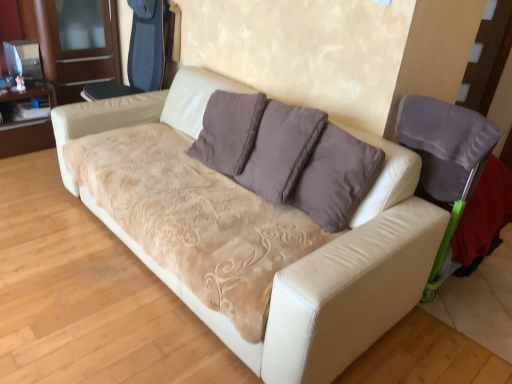
Where is `dark blue fabric armchair at upper left, placed as the 1th armchair when sorted from top to bottom`? This screenshot has width=512, height=384. dark blue fabric armchair at upper left, placed as the 1th armchair when sorted from top to bottom is located at coordinates (142, 52).

This screenshot has height=384, width=512. Find the location of `velvet purple armchair at right, the second armchair positioned from the left`. velvet purple armchair at right, the second armchair positioned from the left is located at coordinates (445, 157).

Could you tell me if brushed wood dresser at left is turned towards dark blue fabric armchair at upper left, which is counted as the 2th armchair, starting from the bottom?

Yes.

Are brushed wood dresser at left and dark blue fabric armchair at upper left, which is the first armchair in back-to-front order, beside each other?

brushed wood dresser at left is not next to dark blue fabric armchair at upper left, which is the first armchair in back-to-front order, and they're not touching.

Can you confirm if brushed wood dresser at left is shorter than dark blue fabric armchair at upper left, placed as the 1th armchair when sorted from top to bottom?

No, brushed wood dresser at left is not shorter than dark blue fabric armchair at upper left, placed as the 1th armchair when sorted from top to bottom.

Which is behind, point (50, 0) or point (152, 80)?

Point (50, 0)

Is brushed wood dresser at left a part of velvet purple armchair at right, which is the second armchair in back-to-front order?

No, brushed wood dresser at left is not inside velvet purple armchair at right, which is the second armchair in back-to-front order.

Is point (425, 163) more distant than point (85, 64)?

That is False.

Considering the sizes of objects velvet purple armchair at right, the first armchair viewed from the front, and brushed wood dresser at left in the image provided, who is thinner, velvet purple armchair at right, the first armchair viewed from the front, or brushed wood dresser at left?

brushed wood dresser at left is thinner.

How different are the orientations of velvet purple armchair at right, placed as the 1th armchair when sorted from right to left, and brushed wood dresser at left in degrees?

The angular difference between velvet purple armchair at right, placed as the 1th armchair when sorted from right to left, and brushed wood dresser at left is 89.7 degrees.

Does white leather couch at center appear on the right side of dark blue fabric armchair at upper left, marked as the first armchair in a left-to-right arrangement?

Yes.

Is white leather couch at center not within dark blue fabric armchair at upper left, which is counted as the 2th armchair, starting from the bottom?

Yes, white leather couch at center is outside of dark blue fabric armchair at upper left, which is counted as the 2th armchair, starting from the bottom.

How many degrees apart are the facing directions of white leather couch at center and dark blue fabric armchair at upper left, which is the second armchair in right-to-left order?

The angle between the facing direction of white leather couch at center and the facing direction of dark blue fabric armchair at upper left, which is the second armchair in right-to-left order, is 0.301 degrees.

Locate an element on the screen. armchair to the left of white leather couch at center is located at coordinates (142, 52).

Which is behind, white leather couch at center or velvet purple armchair at right, which is the 1th armchair in bottom-to-top order?

velvet purple armchair at right, which is the 1th armchair in bottom-to-top order, is more distant.

Is white leather couch at center taller or shorter than velvet purple armchair at right, the second armchair positioned from the left?

Clearly, white leather couch at center is taller compared to velvet purple armchair at right, the second armchair positioned from the left.

Does white leather couch at center touch velvet purple armchair at right, which is the 1th armchair in bottom-to-top order?

They are not placed beside each other.

Do you think white leather couch at center is within velvet purple armchair at right, which is the 1th armchair in bottom-to-top order, or outside of it?

white leather couch at center lies outside velvet purple armchair at right, which is the 1th armchair in bottom-to-top order.

Can you tell me how much dark blue fabric armchair at upper left, which is counted as the 2th armchair, starting from the bottom, and brushed wood dresser at left differ in facing direction?

dark blue fabric armchair at upper left, which is counted as the 2th armchair, starting from the bottom, and brushed wood dresser at left are facing 90.3 degrees away from each other.

Can you confirm if dark blue fabric armchair at upper left, which is counted as the 2th armchair, starting from the bottom, is shorter than brushed wood dresser at left?

Indeed, dark blue fabric armchair at upper left, which is counted as the 2th armchair, starting from the bottom, has a lesser height compared to brushed wood dresser at left.

Which object is thinner, dark blue fabric armchair at upper left, which is the first armchair in back-to-front order, or brushed wood dresser at left?

brushed wood dresser at left is thinner.

Considering the relative positions of dark blue fabric armchair at upper left, which is the first armchair in back-to-front order, and velvet purple armchair at right, placed as the 1th armchair when sorted from right to left, in the image provided, is dark blue fabric armchair at upper left, which is the first armchair in back-to-front order, to the left or to the right of velvet purple armchair at right, placed as the 1th armchair when sorted from right to left,?

Clearly, dark blue fabric armchair at upper left, which is the first armchair in back-to-front order, is on the left of velvet purple armchair at right, placed as the 1th armchair when sorted from right to left, in the image.

You are a GUI agent. You are given a task and a screenshot of the screen. Output one action in this format:
    pyautogui.click(x=<x>, y=<y>)
    Task: Click on the armchair located above the velvet purple armchair at right, the second armchair positioned from the left (from a real-world perspective)
    
    Given the screenshot: What is the action you would take?
    tap(142, 52)

Which is behind, point (144, 8) or point (453, 168)?

The point (144, 8) is farther from the camera.

From a real-world perspective, relative to velvet purple armchair at right, the first armchair viewed from the front, is dark blue fabric armchair at upper left, positioned as the second armchair in front-to-back order, vertically above or below?

Clearly, from a real-world perspective, dark blue fabric armchair at upper left, positioned as the second armchair in front-to-back order, is above velvet purple armchair at right, the first armchair viewed from the front.

Can you confirm if velvet purple armchair at right, which is the 1th armchair in bottom-to-top order, is positioned to the right of white leather couch at center?

Indeed, velvet purple armchair at right, which is the 1th armchair in bottom-to-top order, is positioned on the right side of white leather couch at center.

Is the depth of velvet purple armchair at right, the first armchair viewed from the front, less than that of white leather couch at center?

That is False.

Considering the sizes of velvet purple armchair at right, which is the 1th armchair in bottom-to-top order, and white leather couch at center in the image, is velvet purple armchair at right, which is the 1th armchair in bottom-to-top order, taller or shorter than white leather couch at center?

velvet purple armchair at right, which is the 1th armchair in bottom-to-top order, is shorter than white leather couch at center.

Is velvet purple armchair at right, placed as the 1th armchair when sorted from right to left, looking in the opposite direction of white leather couch at center?

Correct, velvet purple armchair at right, placed as the 1th armchair when sorted from right to left, is looking away from white leather couch at center.

Which armchair is the 1st one when counting from the right side of the brushed wood dresser at left? Please provide its 2D coordinates.

[(142, 52)]

Where is `armchair below the brushed wood dresser at left (from a real-world perspective)`? The image size is (512, 384). armchair below the brushed wood dresser at left (from a real-world perspective) is located at coordinates (445, 157).

From the image, which object appears to be farther from brushed wood dresser at left, white leather couch at center or velvet purple armchair at right, the first armchair viewed from the front?

velvet purple armchair at right, the first armchair viewed from the front.

When comparing their distances from velvet purple armchair at right, the 2th armchair viewed from the top, does white leather couch at center or dark blue fabric armchair at upper left, positioned as the second armchair in front-to-back order, seem further?

dark blue fabric armchair at upper left, positioned as the second armchair in front-to-back order, is positioned further to the anchor velvet purple armchair at right, the 2th armchair viewed from the top.

Considering their positions, is velvet purple armchair at right, the first armchair viewed from the front, positioned further to dark blue fabric armchair at upper left, positioned as the second armchair in front-to-back order, than white leather couch at center?

velvet purple armchair at right, the first armchair viewed from the front, lies further to dark blue fabric armchair at upper left, positioned as the second armchair in front-to-back order, than the other object.

Which object lies further to the anchor point dark blue fabric armchair at upper left, marked as the first armchair in a left-to-right arrangement, white leather couch at center or velvet purple armchair at right, the second armchair positioned from the left?

velvet purple armchair at right, the second armchair positioned from the left, is positioned further to the anchor dark blue fabric armchair at upper left, marked as the first armchair in a left-to-right arrangement.

From the image, which object appears to be nearer to velvet purple armchair at right, which is the 1th armchair in bottom-to-top order, white leather couch at center or brushed wood dresser at left?

Among the two, white leather couch at center is located nearer to velvet purple armchair at right, which is the 1th armchair in bottom-to-top order.

Considering their positions, is velvet purple armchair at right, the second armchair positioned from the left, positioned further to brushed wood dresser at left than white leather couch at center?

Among the two, velvet purple armchair at right, the second armchair positioned from the left, is located further to brushed wood dresser at left.

Estimate the real-world distances between objects in this image. Which object is closer to velvet purple armchair at right, the first armchair viewed from the front, brushed wood dresser at left or white leather couch at center?

The object closer to velvet purple armchair at right, the first armchair viewed from the front, is white leather couch at center.

Based on their spatial positions, is dark blue fabric armchair at upper left, positioned as the second armchair in front-to-back order, or brushed wood dresser at left closer to velvet purple armchair at right, the 2th armchair viewed from the top?

Among the two, dark blue fabric armchair at upper left, positioned as the second armchair in front-to-back order, is located nearer to velvet purple armchair at right, the 2th armchair viewed from the top.

This screenshot has width=512, height=384. What are the coordinates of `studio couch between dark blue fabric armchair at upper left, placed as the 1th armchair when sorted from top to bottom, and velvet purple armchair at right, which is the 1th armchair in bottom-to-top order, in the horizontal direction` in the screenshot? It's located at (304, 258).

Identify the location of armchair between brushed wood dresser at left and velvet purple armchair at right, the first armchair viewed from the front. (x=142, y=52).

You are a GUI agent. You are given a task and a screenshot of the screen. Output one action in this format:
    pyautogui.click(x=<x>, y=<y>)
    Task: Click on the studio couch located between brushed wood dresser at left and velvet purple armchair at right, placed as the 1th armchair when sorted from right to left, in the left-right direction
    This screenshot has height=384, width=512.
    Given the screenshot: What is the action you would take?
    pyautogui.click(x=304, y=258)